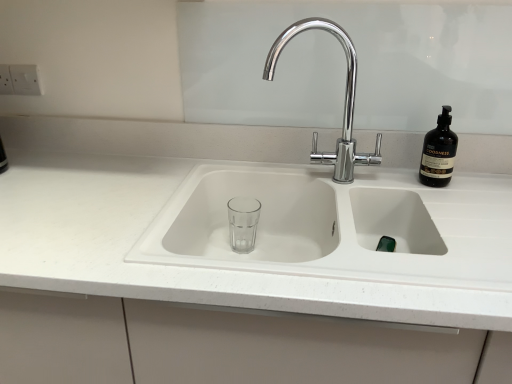
Question: From the image's perspective, is dark brown glass bottle at upper right under white matte countertop at center?

Choices:
 (A) yes
 (B) no

Answer: (B)

Question: From a real-world perspective, is dark brown glass bottle at upper right on white matte countertop at center?

Choices:
 (A) no
 (B) yes

Answer: (B)

Question: Considering the relative sizes of dark brown glass bottle at upper right and white matte countertop at center in the image provided, is dark brown glass bottle at upper right smaller than white matte countertop at center?

Choices:
 (A) yes
 (B) no

Answer: (A)

Question: Is the position of dark brown glass bottle at upper right less distant than that of white matte countertop at center?

Choices:
 (A) yes
 (B) no

Answer: (B)

Question: Considering the relative sizes of dark brown glass bottle at upper right and white matte countertop at center in the image provided, is dark brown glass bottle at upper right thinner than white matte countertop at center?

Choices:
 (A) no
 (B) yes

Answer: (B)

Question: Considering the relative positions of dark brown glass bottle at upper right and white matte countertop at center in the image provided, is dark brown glass bottle at upper right behind white matte countertop at center?

Choices:
 (A) no
 (B) yes

Answer: (B)

Question: From the image's perspective, is white matte countertop at center over dark brown glass bottle at upper right?

Choices:
 (A) yes
 (B) no

Answer: (B)

Question: Is dark brown glass bottle at upper right surrounded by white matte countertop at center?

Choices:
 (A) no
 (B) yes

Answer: (B)

Question: Does white matte countertop at center have a greater width compared to dark brown glass bottle at upper right?

Choices:
 (A) yes
 (B) no

Answer: (A)

Question: Is white matte countertop at center in front of dark brown glass bottle at upper right?

Choices:
 (A) no
 (B) yes

Answer: (B)

Question: Is white matte countertop at center touching dark brown glass bottle at upper right?

Choices:
 (A) no
 (B) yes

Answer: (A)

Question: From the image's perspective, is white matte countertop at center below dark brown glass bottle at upper right?

Choices:
 (A) yes
 (B) no

Answer: (A)

Question: From a real-world perspective, is white matte countertop at center below chrome/metallic faucet at center?

Choices:
 (A) no
 (B) yes

Answer: (B)